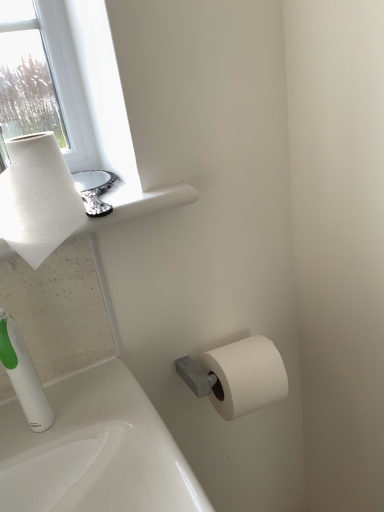
Question: In terms of size, does white matte paper towel at upper left appear bigger or smaller than white textured paper towel at upper left?

Choices:
 (A) big
 (B) small

Answer: (A)

Question: Would you say white matte paper towel at upper left is to the left or to the right of white textured paper towel at upper left in the picture?

Choices:
 (A) left
 (B) right

Answer: (B)

Question: Estimate the real-world distances between objects in this image. Which object is closer to the white matte toilet paper at lower right?

Choices:
 (A) white plastic soap dispenser at lower left
 (B) white matte paper towel at upper left
 (C) white textured paper towel at upper left

Answer: (B)

Question: Based on their relative distances, which object is farther from the white matte paper towel at upper left?

Choices:
 (A) white textured paper towel at upper left
 (B) white matte toilet paper at lower right
 (C) white plastic soap dispenser at lower left

Answer: (B)